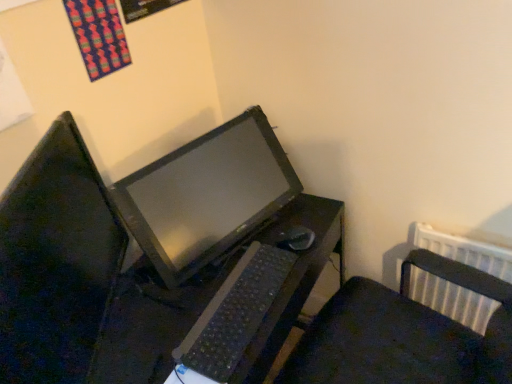
Question: Based on their positions, is black plastic mouse at center located to the left or right of matte black monitor at center?

Choices:
 (A) left
 (B) right

Answer: (B)

Question: Is point (302, 231) closer or farther from the camera than point (76, 292)?

Choices:
 (A) closer
 (B) farther

Answer: (B)

Question: Which object is the closest to the black plastic table at center?

Choices:
 (A) black plastic mouse at center
 (B) black plastic keyboard at center
 (C) matte black monitor at center
 (D) black plastic desk at center

Answer: (D)

Question: Considering the real-world distances, which object is farthest from the black plastic table at center?

Choices:
 (A) matte black monitor at center
 (B) black plastic mouse at center
 (C) black plastic desk at center
 (D) black plastic keyboard at center

Answer: (A)